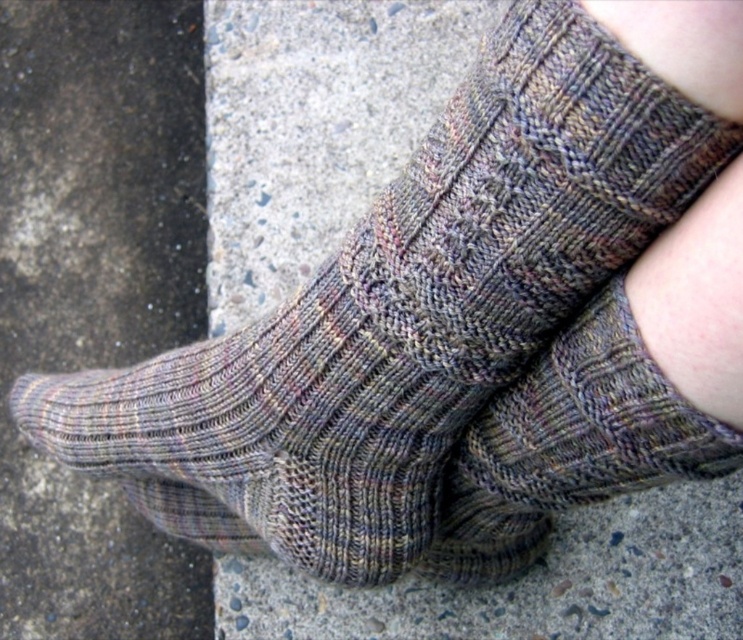
You are standing on the gray concrete at lower left and want to place a small pebble on the multicolored knitted sock at center. Can you reach the sock without bending down?

The gray concrete at lower left is taller than multicolored knitted sock at center, so you would need to bend down to reach the sock.

You are standing on the sidewalk and notice the gray concrete at lower left and the multicolored knitted sock at center. Which object is positioned to the left of the other?

The gray concrete at lower left is to the left of the multicolored knitted sock at center according to the description.

You are standing on the sidewalk and see the gray concrete at lower left and the multicolored knitted sock at center. Which object is higher in position?

The gray concrete at lower left is located above the multicolored knitted sock at center, so it is higher in position.